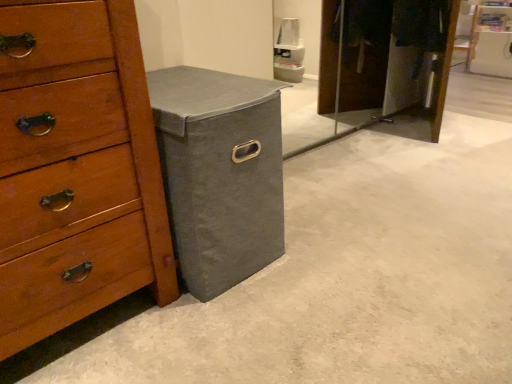
In order to click on empty space that is in between wooden chest of drawers at left and gray fabric storage bin at lower left in this screenshot , I will do `click(145, 330)`.